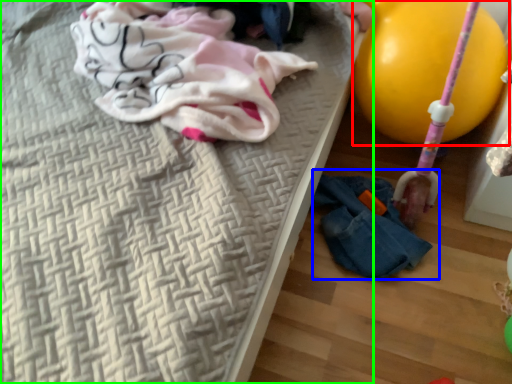
Question: Based on their relative distances, which object is farther from balloon (highlighted by a red box)? Choose from woman (highlighted by a blue box) and bed (highlighted by a green box).

Choices:
 (A) woman
 (B) bed

Answer: (B)